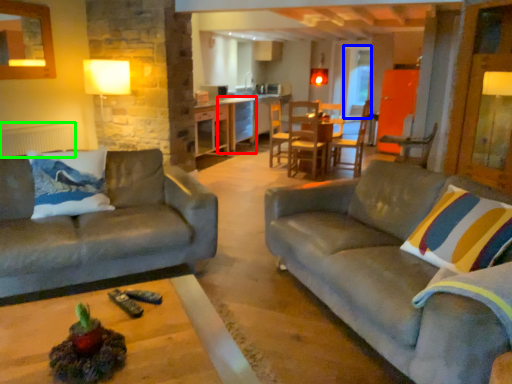
Question: Estimate the real-world distances between objects in this image. Which object is farther from table (highlighted by a red box), glass door (highlighted by a blue box) or radiator (highlighted by a green box)?

Choices:
 (A) glass door
 (B) radiator

Answer: (B)